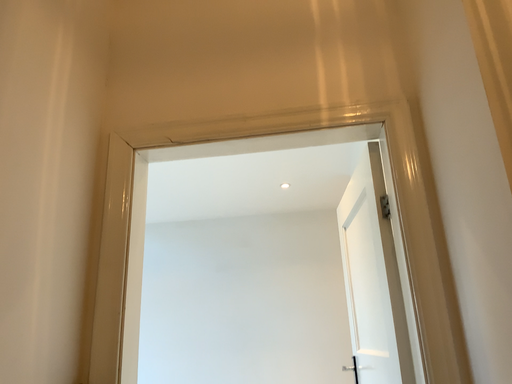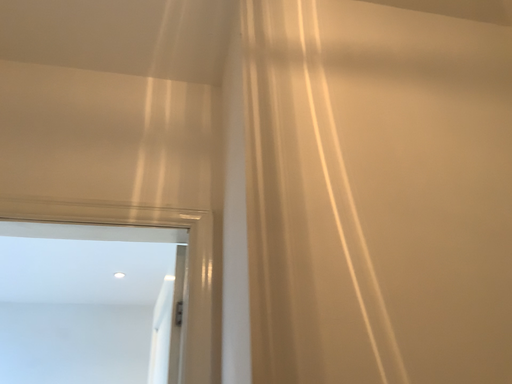
Question: Which way did the camera rotate in the video?

Choices:
 (A) rotated downward
 (B) rotated upward

Answer: (B)